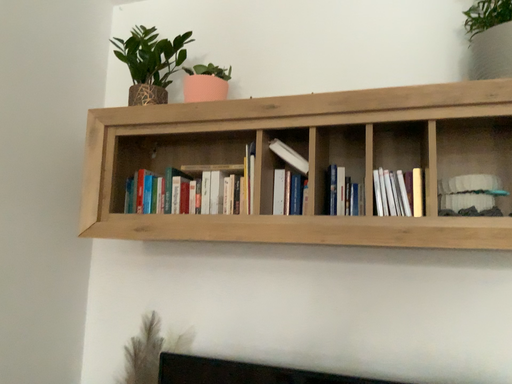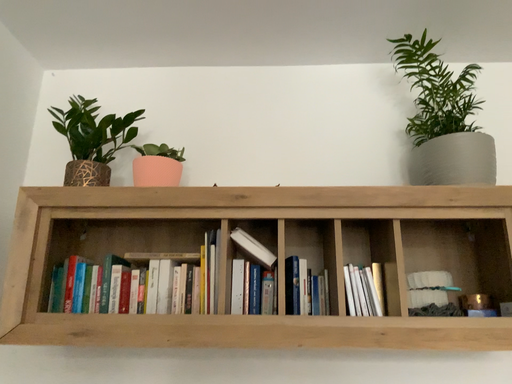
Question: How did the camera likely rotate when shooting the video?

Choices:
 (A) rotated right
 (B) rotated left

Answer: (A)